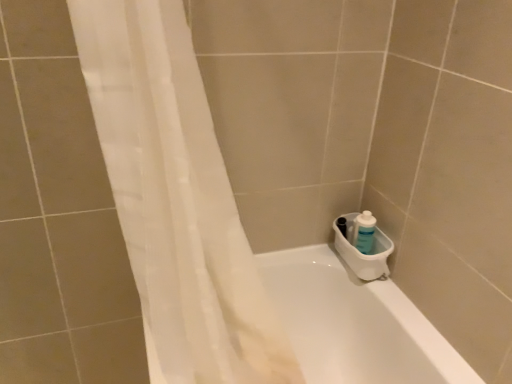
Question: Considering the relative sizes of blue plastic bottle at right and white glossy bathtub at lower right in the image provided, is blue plastic bottle at right thinner than white glossy bathtub at lower right?

Choices:
 (A) yes
 (B) no

Answer: (A)

Question: Is blue plastic bottle at right shorter than white glossy bathtub at lower right?

Choices:
 (A) yes
 (B) no

Answer: (A)

Question: Is white glossy bathtub at lower right at the back of blue plastic bottle at right?

Choices:
 (A) yes
 (B) no

Answer: (B)

Question: Considering the relative sizes of blue plastic bottle at right and white glossy bathtub at lower right in the image provided, is blue plastic bottle at right wider than white glossy bathtub at lower right?

Choices:
 (A) no
 (B) yes

Answer: (A)

Question: Can you confirm if blue plastic bottle at right is smaller than white glossy bathtub at lower right?

Choices:
 (A) yes
 (B) no

Answer: (A)

Question: Considering the relative sizes of blue plastic bottle at right and white glossy bathtub at lower right in the image provided, is blue plastic bottle at right bigger than white glossy bathtub at lower right?

Choices:
 (A) no
 (B) yes

Answer: (A)

Question: Is white plastic sink at lower right completely or partially inside blue plastic bottle at right?

Choices:
 (A) no
 (B) yes

Answer: (A)

Question: Are blue plastic bottle at right and white plastic sink at lower right located far from each other?

Choices:
 (A) yes
 (B) no

Answer: (B)

Question: Can you confirm if blue plastic bottle at right is positioned to the right of white plastic sink at lower right?

Choices:
 (A) no
 (B) yes

Answer: (B)

Question: From a real-world perspective, is blue plastic bottle at right on top of white plastic sink at lower right?

Choices:
 (A) yes
 (B) no

Answer: (A)

Question: Can you confirm if blue plastic bottle at right is positioned to the left of white plastic sink at lower right?

Choices:
 (A) yes
 (B) no

Answer: (B)

Question: Is blue plastic bottle at right positioned with its back to white plastic sink at lower right?

Choices:
 (A) yes
 (B) no

Answer: (A)

Question: Is white sheer curtain at left directly adjacent to white plastic sink at lower right?

Choices:
 (A) yes
 (B) no

Answer: (B)